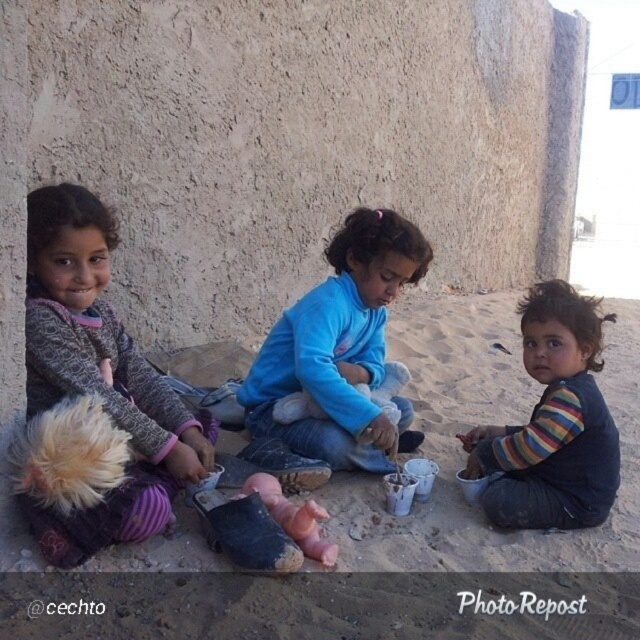
Between brown sandy ground at center and blue fleece jacket at center, which one is positioned higher?

Positioned higher is blue fleece jacket at center.

Describe the element at coordinates (465, 454) in the screenshot. I see `brown sandy ground at center` at that location.

I want to click on brown sandy ground at center, so click(x=465, y=454).

From the picture: Does knitted gray sweater at left have a larger size compared to striped fabric shirt at center?

Indeed, knitted gray sweater at left has a larger size compared to striped fabric shirt at center.

Does knitted gray sweater at left appear over striped fabric shirt at center?

Yes, knitted gray sweater at left is above striped fabric shirt at center.

Which is behind, point (93, 253) or point (556, 298)?

Positioned behind is point (556, 298).

Where is `knitted gray sweater at left`? knitted gray sweater at left is located at coordinates (96, 332).

Between point (458, 464) and point (148, 436), which one is positioned behind?

The point (458, 464) is behind.

Who is taller, brown sandy ground at center or knitted gray sweater at left?

knitted gray sweater at left is taller.

The height and width of the screenshot is (640, 640). I want to click on brown sandy ground at center, so click(465, 454).